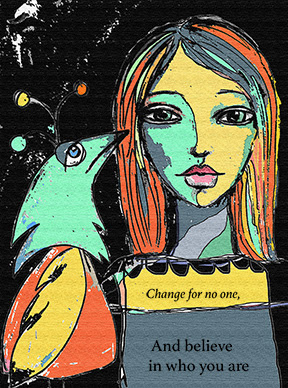
Find the location of a particular element. Image resolution: width=288 pixels, height=388 pixels. artwork is located at coordinates (197, 326).